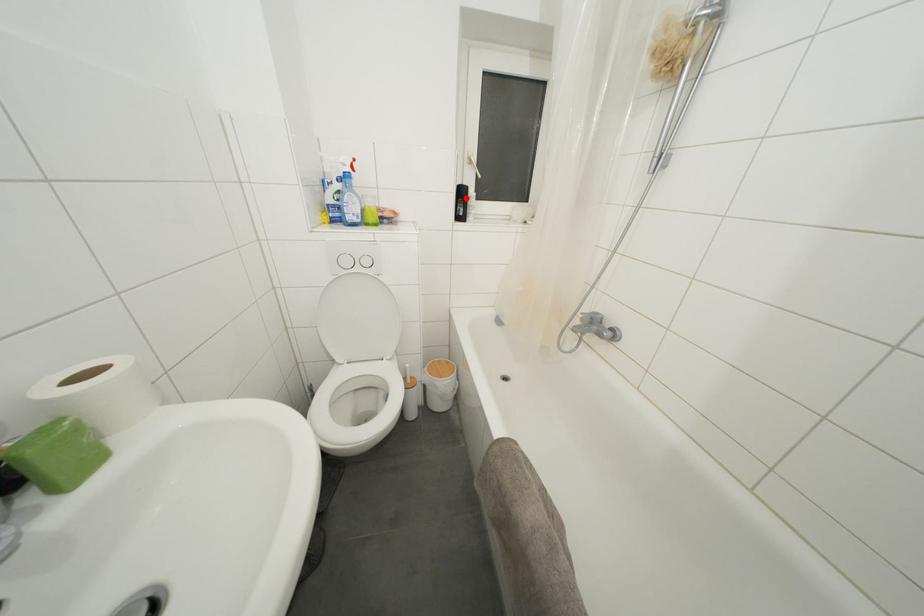
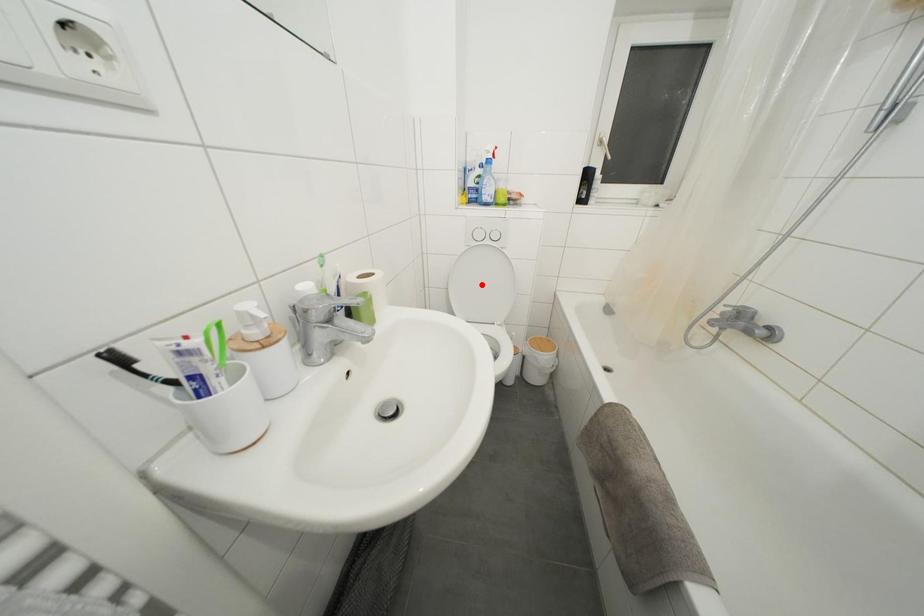
I am providing you with two images of the same scene from different viewpoints. A red point is marked on the first image and another point is marked on the second image. Do the highlighted points in image1 and image2 indicate the same real-world spot?

No